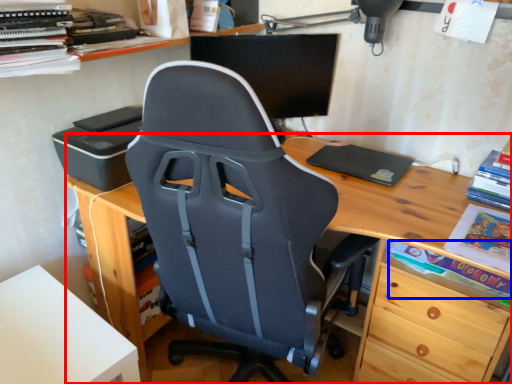
Question: Which object is further to the camera taking this photo, desk (highlighted by a red box) or book (highlighted by a blue box)?

Choices:
 (A) desk
 (B) book

Answer: (B)